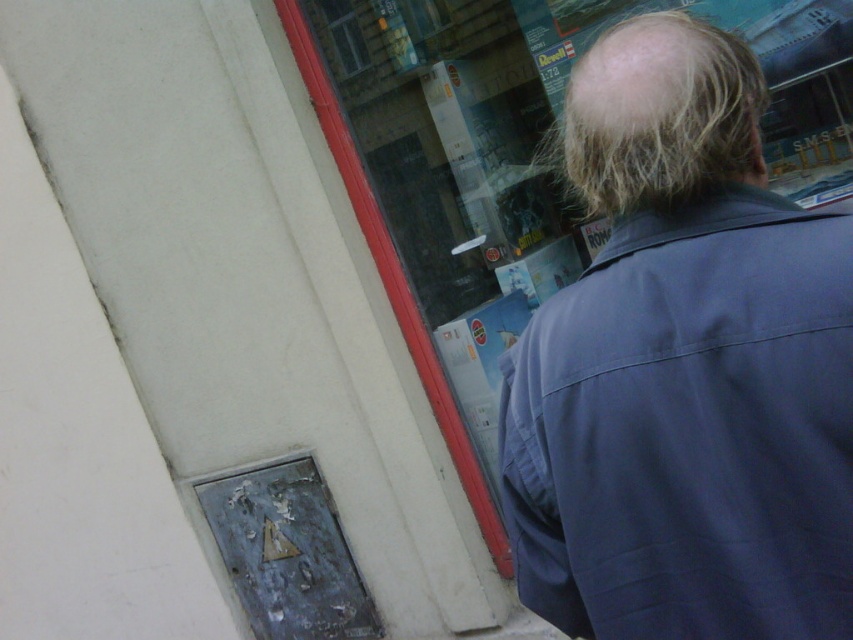
Who is shorter, dark blue fabric at upper right or blonde hair at upper right?

blonde hair at upper right is shorter.

Between dark blue fabric at upper right and blonde hair at upper right, which one is positioned higher?

blonde hair at upper right is higher up.

You are a GUI agent. You are given a task and a screenshot of the screen. Output one action in this format:
    pyautogui.click(x=<x>, y=<y>)
    Task: Click on the dark blue fabric at upper right
    The height and width of the screenshot is (640, 853).
    Given the screenshot: What is the action you would take?
    pos(683,369)